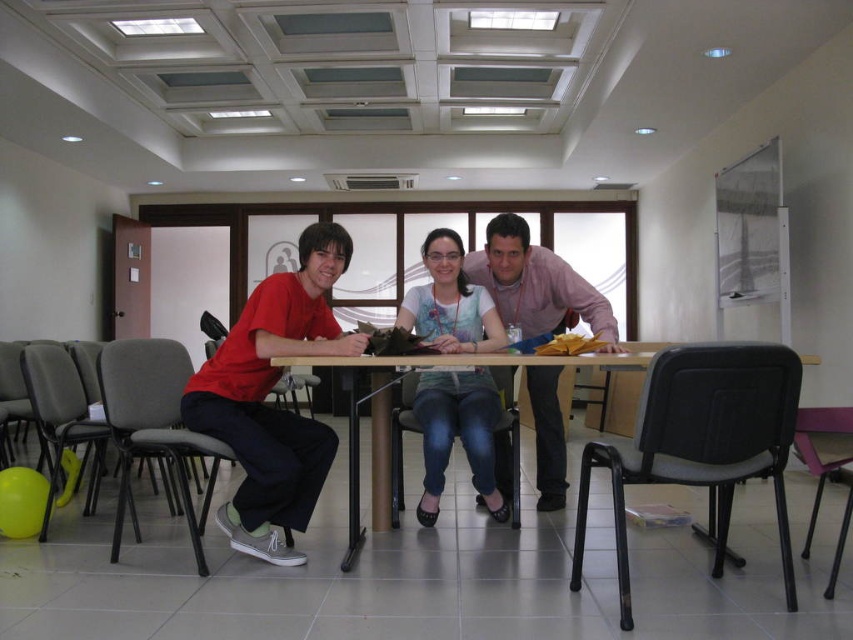
From the picture: You are sitting at the wooden table at center and want to hand a document to the person wearing the matte white shirt at center. In which direction should you pass the document?

The matte white shirt at center is to the right of the wooden table at center, so you should pass the document to your right.

You are organizing a meeting and need to place a 12x12 inch nameplate on the wooden table at center. The matte red shirt at left is currently occupying some space. Can the nameplate fit on the remaining space?

The matte red shirt at left has a smaller size compared to the wooden table at center. Since the shirt is smaller, it likely occupies less space, leaving enough room for the 12x12 inch nameplate on the wooden table at center.